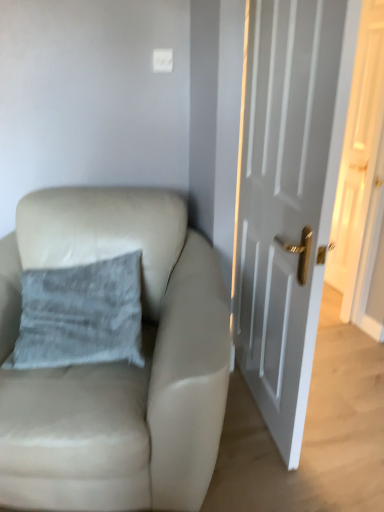
Question: Is gray fabric pillow at upper left at the back of white glossy door at right, the 2th door from the left?

Choices:
 (A) yes
 (B) no

Answer: (B)

Question: From the image's perspective, is white glossy door at right, which appears as the second door when viewed from the front, on gray fabric pillow at upper left?

Choices:
 (A) no
 (B) yes

Answer: (B)

Question: Can you confirm if white glossy door at right, which appears as the second door when viewed from the front, is bigger than gray fabric pillow at upper left?

Choices:
 (A) no
 (B) yes

Answer: (A)

Question: Is white glossy door at right, which appears as the second door when viewed from the front, not close to gray fabric pillow at upper left?

Choices:
 (A) yes
 (B) no

Answer: (A)

Question: Can you confirm if white glossy door at right, the 2th door from the left, is shorter than gray fabric pillow at upper left?

Choices:
 (A) no
 (B) yes

Answer: (A)

Question: From the image's perspective, does white glossy door at right, which is counted as the 1th door, starting from the back, appear lower than gray fabric pillow at upper left?

Choices:
 (A) no
 (B) yes

Answer: (A)

Question: Does white glossy door at right, which is the 1th door in right-to-left order, come behind beige leather chair at left?

Choices:
 (A) no
 (B) yes

Answer: (B)

Question: Is white glossy door at right, which is the 1th door in right-to-left order, facing towards beige leather chair at left?

Choices:
 (A) no
 (B) yes

Answer: (A)

Question: Does white glossy door at right, which appears as the second door when viewed from the front, appear on the left side of beige leather chair at left?

Choices:
 (A) no
 (B) yes

Answer: (A)

Question: Can you confirm if white glossy door at right, which is the 1th door in right-to-left order, is smaller than beige leather chair at left?

Choices:
 (A) no
 (B) yes

Answer: (B)

Question: From the image's perspective, does white glossy door at right, the 2th door from the left, appear higher than beige leather chair at left?

Choices:
 (A) no
 (B) yes

Answer: (B)

Question: From a real-world perspective, is white glossy door at right, which is the 1th door in right-to-left order, beneath beige leather chair at left?

Choices:
 (A) yes
 (B) no

Answer: (B)

Question: From a real-world perspective, does white glossy door at right, positioned as the first door in front-to-back order, sit lower than beige leather chair at left?

Choices:
 (A) no
 (B) yes

Answer: (A)